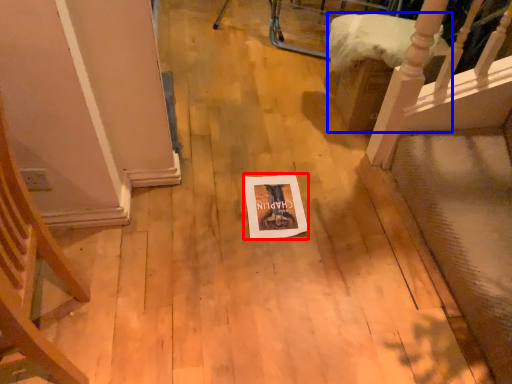
Question: Which object is closer to the camera taking this photo, postcard (highlighted by a red box) or furniture (highlighted by a blue box)?

Choices:
 (A) postcard
 (B) furniture

Answer: (A)